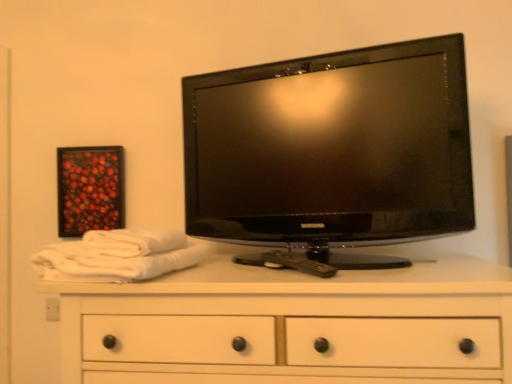
Where is `wooden framed artwork at upper left`? This screenshot has width=512, height=384. wooden framed artwork at upper left is located at coordinates (90, 189).

I want to click on white cotton bath towel at left, marked as the 2th bath towel in a top-to-bottom arrangement, so click(118, 256).

Where is `black glossy tv at upper center`? black glossy tv at upper center is located at coordinates (332, 151).

The height and width of the screenshot is (384, 512). What do you see at coordinates (332, 151) in the screenshot?
I see `black glossy tv at upper center` at bounding box center [332, 151].

What do you see at coordinates (134, 241) in the screenshot? The height and width of the screenshot is (384, 512). I see `white cotton bath towel at left, which is counted as the 2th bath towel, starting from the bottom` at bounding box center [134, 241].

The height and width of the screenshot is (384, 512). Identify the location of wooden framed artwork at upper left. (90, 189).

Considering the positions of point (105, 362) and point (120, 161), is point (105, 362) closer or farther from the camera than point (120, 161)?

Point (105, 362) appears to be closer to the viewer than point (120, 161).

In the image, there is a wooden framed artwork at upper left. Identify the location of the chest of drawers below it (from a real-world perspective). This screenshot has height=384, width=512. (291, 319).

Is white wood chest of drawers at center turned away from wooden framed artwork at upper left?

No, wooden framed artwork at upper left is not at the back of white wood chest of drawers at center.

From a real-world perspective, which is physically below, white wood chest of drawers at center or wooden framed artwork at upper left?

white wood chest of drawers at center.

Can you confirm if white cotton bath towel at left, which is the first bath towel from top to bottom, is smaller than white cotton bath towel at left, the 1th bath towel positioned from the bottom?

Indeed, white cotton bath towel at left, which is the first bath towel from top to bottom, has a smaller size compared to white cotton bath towel at left, the 1th bath towel positioned from the bottom.

Does point (136, 235) come in front of point (44, 258)?

No, it is behind (44, 258).

Who is more distant, white cotton bath towel at left, which is the first bath towel from top to bottom, or white cotton bath towel at left, marked as the 2th bath towel in a top-to-bottom arrangement?

white cotton bath towel at left, which is the first bath towel from top to bottom, is further from the camera.

Is white cotton bath towel at left, which is counted as the 2th bath towel, starting from the bottom, to the left or to the right of white cotton bath towel at left, the 1th bath towel positioned from the bottom, in the image?

white cotton bath towel at left, which is counted as the 2th bath towel, starting from the bottom, is to the right of white cotton bath towel at left, the 1th bath towel positioned from the bottom.

Is white cotton bath towel at left, which is the first bath towel from top to bottom, oriented towards black glossy tv at upper center?

No.

I want to click on the 1st bath towel below when counting from the black glossy tv at upper center (from the image's perspective), so click(x=134, y=241).

Does white cotton bath towel at left, which is counted as the 2th bath towel, starting from the bottom, have a greater height compared to black glossy tv at upper center?

No.

Which of these two, white wood chest of drawers at center or black glossy tv at upper center, stands shorter?

Standing shorter between the two is white wood chest of drawers at center.

Is white wood chest of drawers at center closer to the viewer compared to black glossy tv at upper center?

Yes, it is.

Which is correct: white wood chest of drawers at center is inside black glossy tv at upper center, or outside of it?

white wood chest of drawers at center cannot be found inside black glossy tv at upper center.

Find the location of a particular element. This screenshot has width=512, height=384. chest of drawers on the right of wooden framed artwork at upper left is located at coordinates (291, 319).

Is wooden framed artwork at upper left behind white wood chest of drawers at center?

Yes, wooden framed artwork at upper left is behind white wood chest of drawers at center.

Which object is thinner, wooden framed artwork at upper left or white wood chest of drawers at center?

wooden framed artwork at upper left.

Is wooden framed artwork at upper left taller than white wood chest of drawers at center?

Incorrect, the height of wooden framed artwork at upper left is not larger of that of white wood chest of drawers at center.

The image size is (512, 384). I want to click on television that appears on the right of white cotton bath towel at left, marked as the 2th bath towel in a top-to-bottom arrangement, so click(x=332, y=151).

Which of these two, white cotton bath towel at left, the 1th bath towel positioned from the bottom, or black glossy tv at upper center, is bigger?

black glossy tv at upper center is bigger.

Is white cotton bath towel at left, the 1th bath towel positioned from the bottom, oriented towards black glossy tv at upper center?

No, white cotton bath towel at left, the 1th bath towel positioned from the bottom, is not turned towards black glossy tv at upper center.

From a real-world perspective, who is located higher, white cotton bath towel at left, marked as the 2th bath towel in a top-to-bottom arrangement, or black glossy tv at upper center?

black glossy tv at upper center, from a real-world perspective.

Based on the photo, considering the sizes of wooden framed artwork at upper left and black glossy tv at upper center in the image, is wooden framed artwork at upper left wider or thinner than black glossy tv at upper center?

In the image, wooden framed artwork at upper left appears to be more narrow than black glossy tv at upper center.

Is wooden framed artwork at upper left not inside black glossy tv at upper center?

Absolutely, wooden framed artwork at upper left is external to black glossy tv at upper center.

Looking at this image, which of these two, wooden framed artwork at upper left or black glossy tv at upper center, stands taller?

black glossy tv at upper center is taller.

Is wooden framed artwork at upper left looking in the opposite direction of black glossy tv at upper center?

No, wooden framed artwork at upper left's orientation is not away from black glossy tv at upper center.

Locate an element on the screen. chest of drawers below the wooden framed artwork at upper left (from the image's perspective) is located at coordinates (291, 319).

Where is `bath towel below the white cotton bath towel at left, which is counted as the 2th bath towel, starting from the bottom (from a real-world perspective)`? The image size is (512, 384). bath towel below the white cotton bath towel at left, which is counted as the 2th bath towel, starting from the bottom (from a real-world perspective) is located at coordinates 118,256.

Estimate the real-world distances between objects in this image. Which object is closer to black glossy tv at upper center, white cotton bath towel at left, marked as the 2th bath towel in a top-to-bottom arrangement, or wooden framed artwork at upper left?

white cotton bath towel at left, marked as the 2th bath towel in a top-to-bottom arrangement.

From the image, which object appears to be nearer to white cotton bath towel at left, which is counted as the 2th bath towel, starting from the bottom, white wood chest of drawers at center or white cotton bath towel at left, the 1th bath towel positioned from the bottom?

The object closer to white cotton bath towel at left, which is counted as the 2th bath towel, starting from the bottom, is white cotton bath towel at left, the 1th bath towel positioned from the bottom.

From the image, which object appears to be farther from wooden framed artwork at upper left, white wood chest of drawers at center or white cotton bath towel at left, the 1th bath towel positioned from the bottom?

white wood chest of drawers at center is further to wooden framed artwork at upper left.

Based on their spatial positions, is black glossy tv at upper center or white wood chest of drawers at center further from white cotton bath towel at left, which is counted as the 2th bath towel, starting from the bottom?

black glossy tv at upper center.

Which object lies further to the anchor point wooden framed artwork at upper left, white wood chest of drawers at center or white cotton bath towel at left, which is the first bath towel from top to bottom?

Based on the image, white wood chest of drawers at center appears to be further to wooden framed artwork at upper left.

Based on their spatial positions, is white cotton bath towel at left, marked as the 2th bath towel in a top-to-bottom arrangement, or wooden framed artwork at upper left closer to white wood chest of drawers at center?

white cotton bath towel at left, marked as the 2th bath towel in a top-to-bottom arrangement, is positioned closer to the anchor white wood chest of drawers at center.

Based on their spatial positions, is white cotton bath towel at left, the 1th bath towel positioned from the bottom, or white cotton bath towel at left, which is the first bath towel from top to bottom, further from wooden framed artwork at upper left?

Among the two, white cotton bath towel at left, which is the first bath towel from top to bottom, is located further to wooden framed artwork at upper left.

When comparing their distances from white cotton bath towel at left, the 1th bath towel positioned from the bottom, does white wood chest of drawers at center or white cotton bath towel at left, which is the first bath towel from top to bottom, seem further?

white wood chest of drawers at center.

Where is `bath towel between white cotton bath towel at left, the 1th bath towel positioned from the bottom, and wooden framed artwork at upper left from front to back`? This screenshot has height=384, width=512. bath towel between white cotton bath towel at left, the 1th bath towel positioned from the bottom, and wooden framed artwork at upper left from front to back is located at coordinates (134, 241).

You are a GUI agent. You are given a task and a screenshot of the screen. Output one action in this format:
    pyautogui.click(x=<x>, y=<y>)
    Task: Click on the chest of drawers situated between white cotton bath towel at left, which is counted as the 2th bath towel, starting from the bottom, and black glossy tv at upper center from left to right
    This screenshot has width=512, height=384.
    Given the screenshot: What is the action you would take?
    pyautogui.click(x=291, y=319)

At what (x,y) coordinates should I click in order to perform the action: click on bath towel between white cotton bath towel at left, the 1th bath towel positioned from the bottom, and white wood chest of drawers at center. Please return your answer as a coordinate pair (x, y). This screenshot has height=384, width=512. Looking at the image, I should click on (134, 241).

Where is `bath towel located between white cotton bath towel at left, the 1th bath towel positioned from the bottom, and black glossy tv at upper center in the left-right direction`? The image size is (512, 384). bath towel located between white cotton bath towel at left, the 1th bath towel positioned from the bottom, and black glossy tv at upper center in the left-right direction is located at coordinates (134, 241).